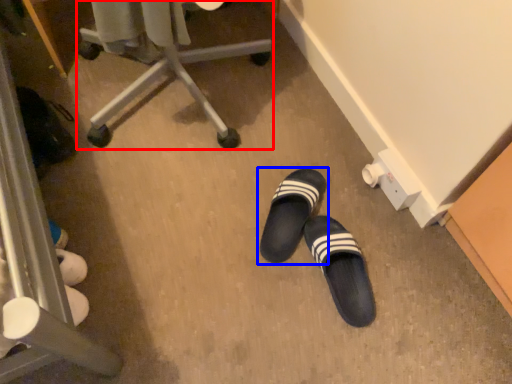
Question: Which point is closer to the camera, furniture (highlighted by a red box) or footwear (highlighted by a blue box)?

Choices:
 (A) furniture
 (B) footwear

Answer: (A)